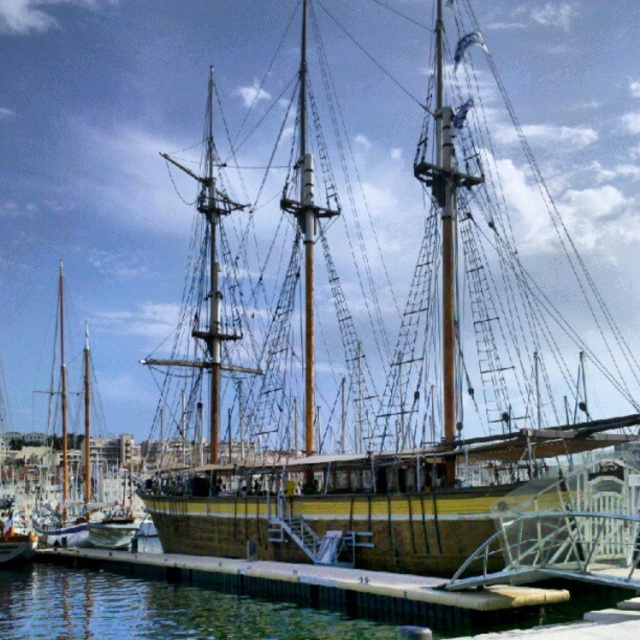
You are standing on the dock and want to board the wooden ship at center. There is a wooden mast at center in your path. Which object will you encounter first as you walk towards the ship?

You will encounter the wooden mast at center first because the wooden ship at center is farther away, so the mast is closer to you on the path towards the ship.

You are standing on the dock and looking towards the wooden ship at center and the wooden mast at center. Which object is positioned lower in the image?

The wooden ship at center is located below the wooden mast at center, so it is positioned lower in the image.